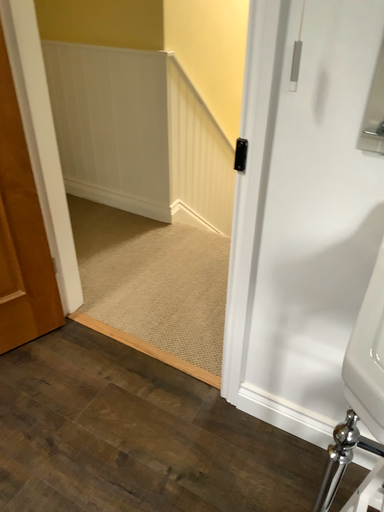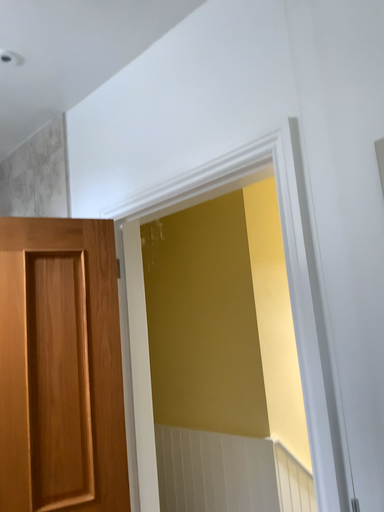
Question: How did the camera likely rotate when shooting the video?

Choices:
 (A) rotated right
 (B) rotated left

Answer: (B)